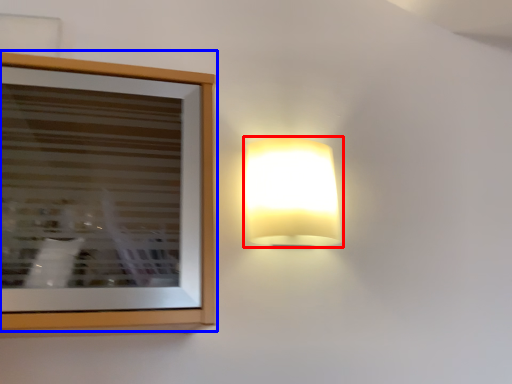
Question: Among these objects, which one is nearest to the camera, lamp (highlighted by a red box) or picture frame (highlighted by a blue box)?

Choices:
 (A) lamp
 (B) picture frame

Answer: (B)